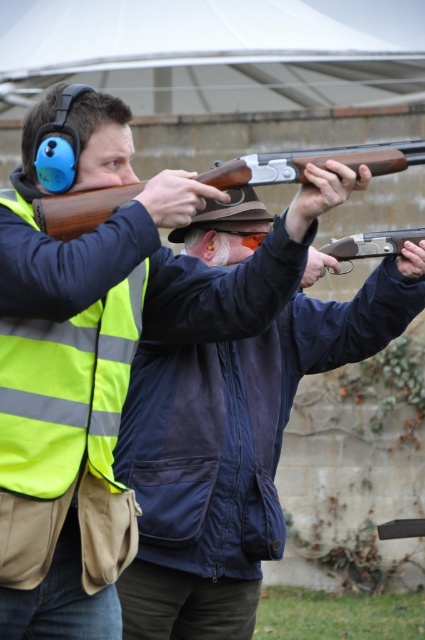
Question: Is matte brown shotgun at center wider than wooden shotgun at center?

Choices:
 (A) no
 (B) yes

Answer: (A)

Question: Does wooden shotgun at center appear on the right side of matte brown shotgun at upper center?

Choices:
 (A) no
 (B) yes

Answer: (A)

Question: Is matte brown shotgun at center wider than wooden shotgun at center?

Choices:
 (A) no
 (B) yes

Answer: (A)

Question: Which point appears closest to the camera in this image?

Choices:
 (A) (139, 611)
 (B) (371, 248)
 (C) (286, 182)

Answer: (C)

Question: Which object is positioned closest to the matte brown shotgun at upper center?

Choices:
 (A) wooden shotgun at center
 (B) matte brown shotgun at center

Answer: (B)

Question: Among these points, which one is farthest from the camera?

Choices:
 (A) (53, 208)
 (B) (368, 250)
 (C) (274, 504)

Answer: (B)